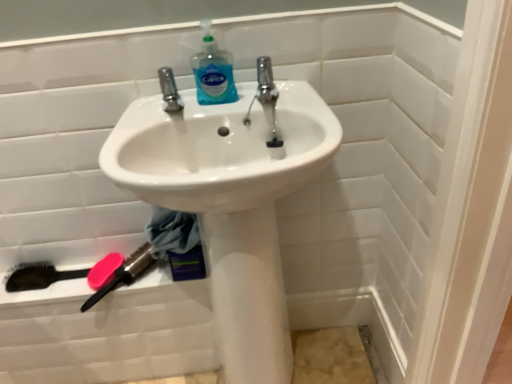
Locate an element on the screen. The height and width of the screenshot is (384, 512). vacant area that lies to the right of polished chrome tap at center is located at coordinates (302, 92).